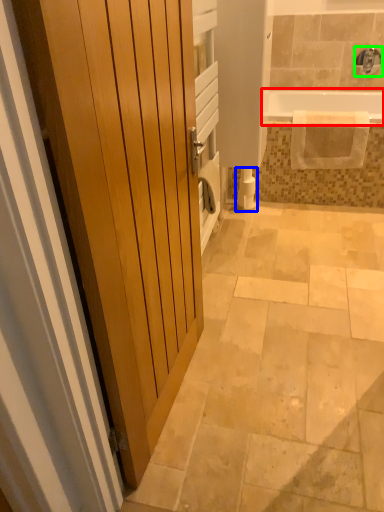
Question: Which object is the closest to the bathtub (highlighted by a red box)? Choose among these: toilet paper (highlighted by a blue box) or faucet (highlighted by a green box).

Choices:
 (A) toilet paper
 (B) faucet

Answer: (B)